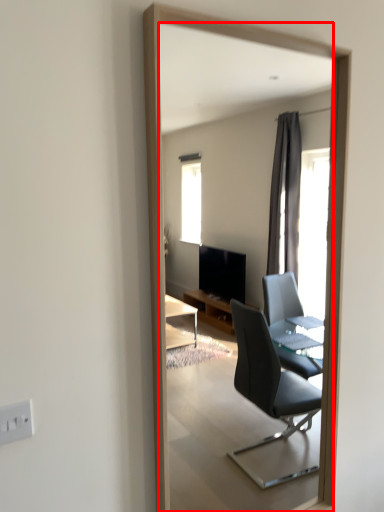
Question: From the image's perspective, what is the correct spatial positioning of mirror (annotated by the red box) in reference to electric outlet?

Choices:
 (A) above
 (B) below

Answer: (A)